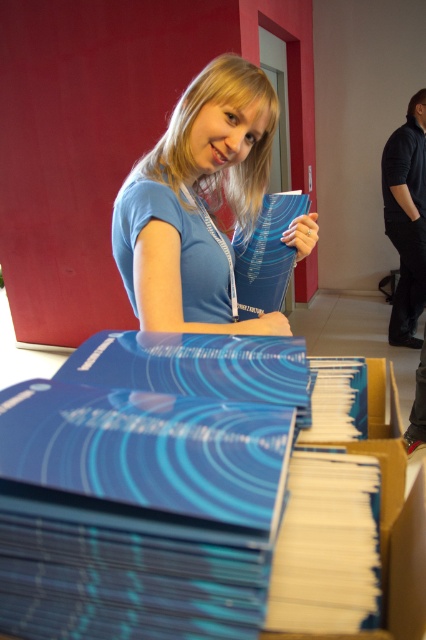
You are a delivery person who needs to place a new brochure on the table. The new brochure is the same size as the blue glossy book at lower center. The table has limited space, and you must ensure that the new brochure is placed exactly 36 inches away from the matte blue book at upper center. Can you fit the new brochure on the table without moving any existing items?

The distance between the blue glossy book at lower center and the matte blue book at upper center is 35.19 inches. Since the required placement is 36 inches away from the matte blue book at upper center, the new brochure cannot be placed at the required distance without moving existing items.

You are organizing a booth at an event and need to place a new blue matte book at center on the table. However, there is already a matte blue book at upper center in front of the woman. Which book should you place lower to make space?

Since the blue matte book at center is much taller than the matte blue book at upper center, you should place the matte blue book at upper center lower to make space for the taller book.